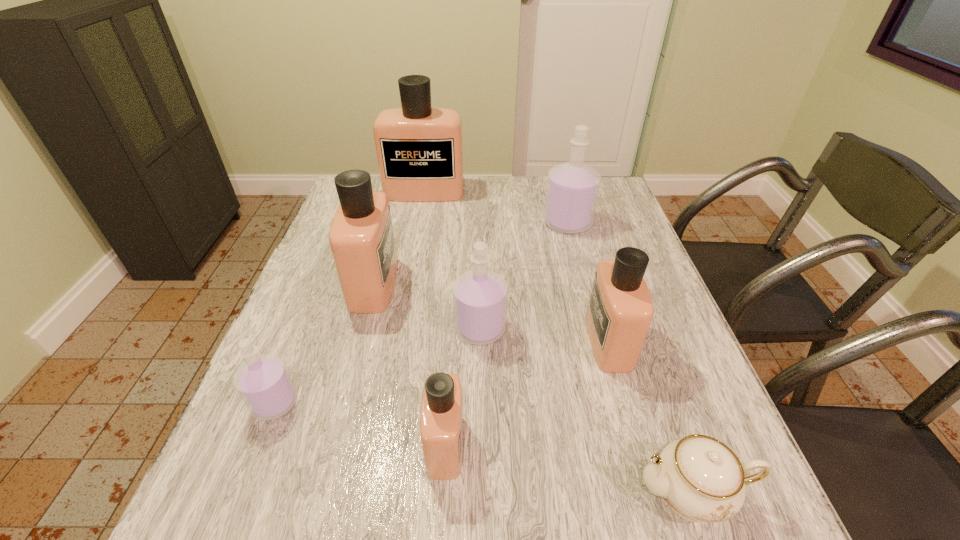
The image size is (960, 540). Identify the location of free spot between the third biggest beige perfume and the leftmost purple perfume. (442, 372).

Select which object is the closest to the smallest beige perfume. Please provide its 2D coordinates. Your answer should be formatted as a tuple, i.e. [(x, y)], where the tuple contains the x and y coordinates of a point satisfying the conditions above.

[(479, 296)]

Find the location of a particular element. object that is the third closest one to the second farthest object is located at coordinates (479, 296).

At what (x,y) coordinates should I click in order to perform the action: click on perfume that is the fourth closest one to the rightmost beige perfume. Please return your answer as a coordinate pair (x, y). The width and height of the screenshot is (960, 540). Looking at the image, I should click on (361, 237).

Locate which perfume ranks fifth in proximity to the third biggest beige perfume. Please provide its 2D coordinates. Your answer should be formatted as a tuple, i.e. [(x, y)], where the tuple contains the x and y coordinates of a point satisfying the conditions above.

[(419, 148)]

What are the coordinates of `the closest beige perfume to the seventh nearest object` in the screenshot? It's located at (419, 148).

Where is `beige perfume that is the closest to the second biggest beige perfume`? Image resolution: width=960 pixels, height=540 pixels. beige perfume that is the closest to the second biggest beige perfume is located at coordinates (419, 148).

This screenshot has height=540, width=960. Identify the location of purple perfume that is the closest to the leftmost perfume. (479, 296).

The width and height of the screenshot is (960, 540). I want to click on the closest purple perfume to the third smallest beige perfume, so click(479, 296).

Identify the location of free space in the image that satisfies the following two spatial constraints: 1. on the front side of the biggest purple perfume; 2. on the front label of the third smallest beige perfume. The width and height of the screenshot is (960, 540). (584, 284).